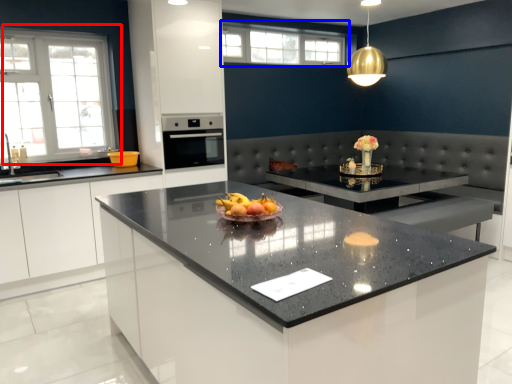
Question: Which object is further to the camera taking this photo, window (highlighted by a red box) or window (highlighted by a blue box)?

Choices:
 (A) window
 (B) window

Answer: (B)